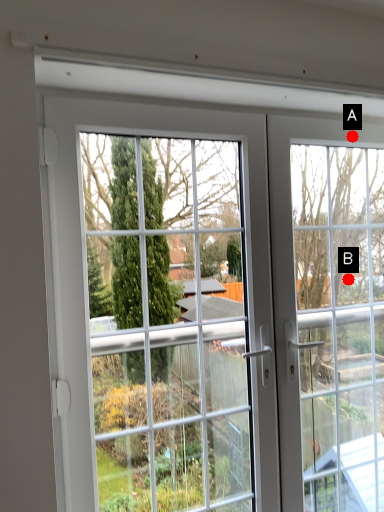
Question: Two points are circled on the image, labeled by A and B beside each circle. Which of the following is the closest to the observer?

Choices:
 (A) A is closer
 (B) B is closer

Answer: (A)